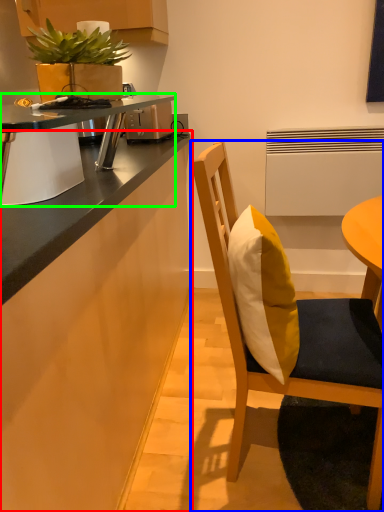
Question: Which object is positioned closest to cabinetry (highlighted by a red box)? Select from chair (highlighted by a blue box) and desk (highlighted by a green box).

Choices:
 (A) chair
 (B) desk

Answer: (B)